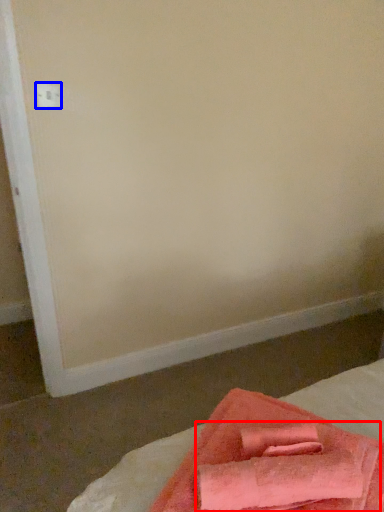
Question: Which of the following is the farthest to the observer, bath towel (highlighted by a red box) or electric outlet (highlighted by a blue box)?

Choices:
 (A) bath towel
 (B) electric outlet

Answer: (B)